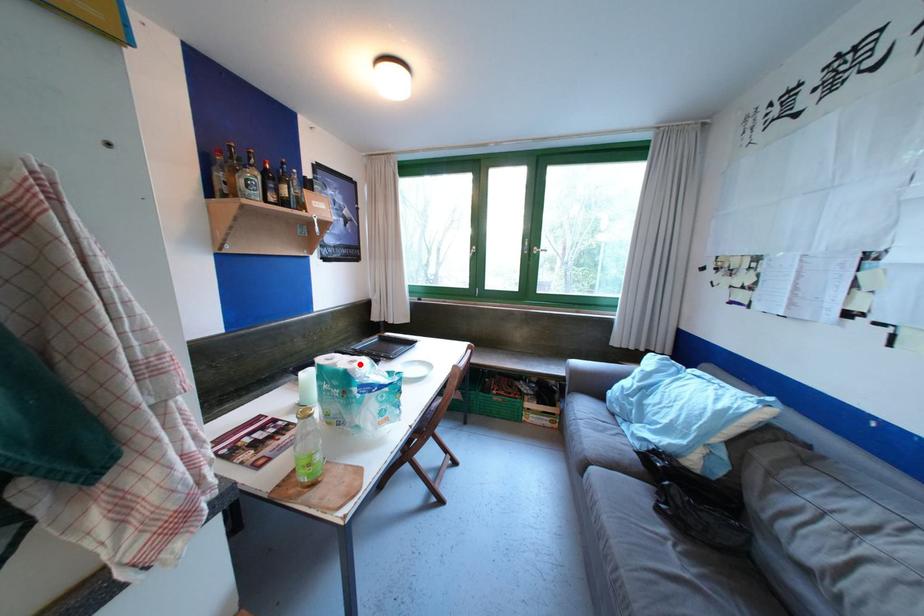
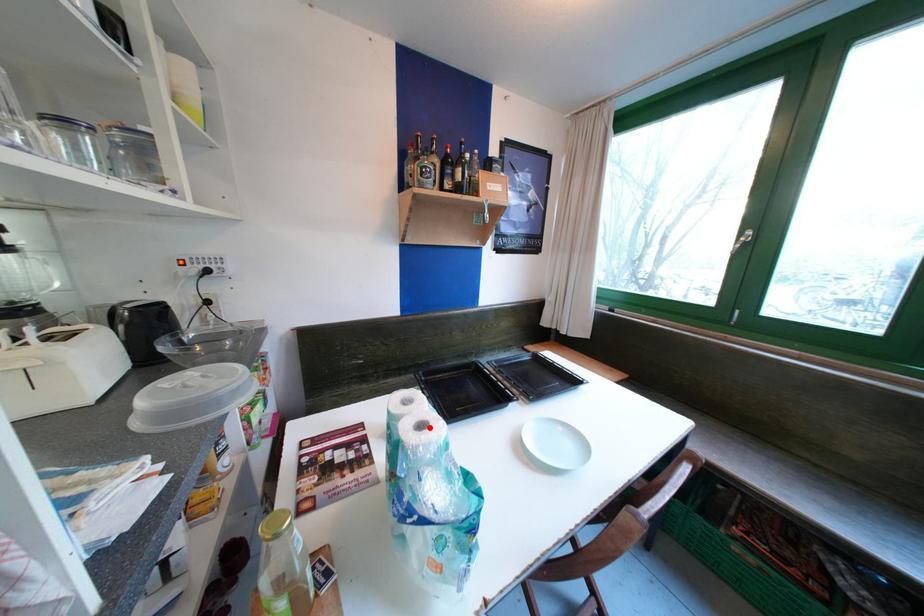
I am providing you with two images of the same scene from different viewpoints. A red point is marked on the first image and another point is marked on the second image. Do the highlighted points in image1 and image2 indicate the same real-world spot?

Yes